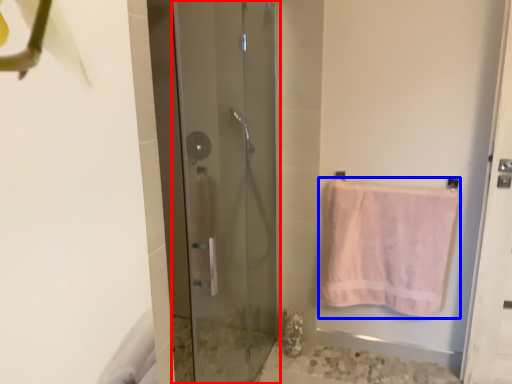
Question: Among these objects, which one is farthest to the camera, door (highlighted by a red box) or towel (highlighted by a blue box)?

Choices:
 (A) door
 (B) towel

Answer: (B)